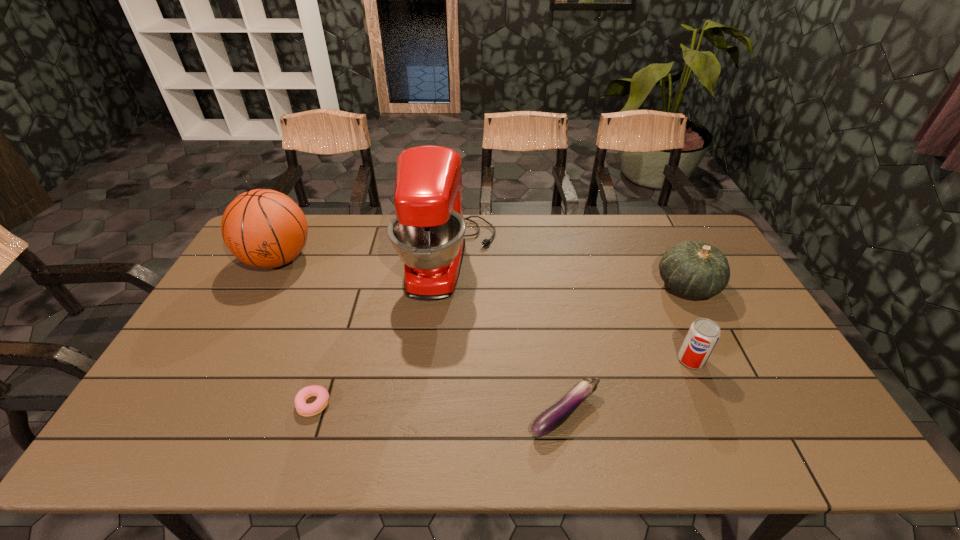
Locate an element on the screen. This screenshot has height=540, width=960. free space in the image that satisfies the following two spatial constraints: 1. on the back side of the fourth farthest object; 2. on the front-facing side of the tallest object is located at coordinates (647, 260).

What are the coordinates of `vacant space that satisfies the following two spatial constraints: 1. on the front side of the basketball; 2. on the right side of the third nearest object` in the screenshot? It's located at (x=225, y=360).

I want to click on vacant position in the image that satisfies the following two spatial constraints: 1. on the front side of the second tallest object; 2. on the left side of the gourd, so click(x=264, y=286).

Identify the location of free space that satisfies the following two spatial constraints: 1. on the back side of the gourd; 2. on the front-facing side of the fourth object from right to left. The width and height of the screenshot is (960, 540). (674, 260).

The image size is (960, 540). In order to click on vacant region that satisfies the following two spatial constraints: 1. on the front-facing side of the fourth farthest object; 2. on the left side of the third object from left to right in this screenshot , I will do `click(441, 360)`.